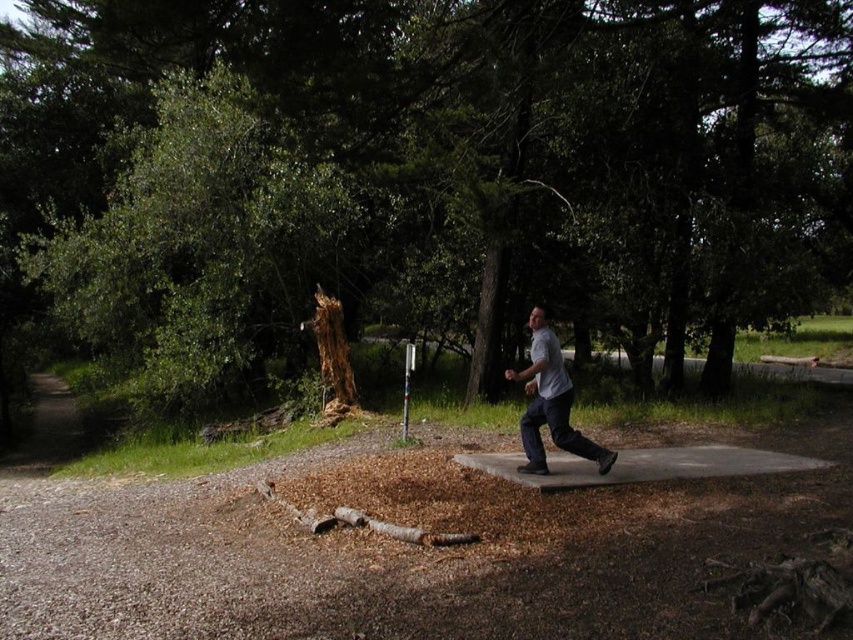
Question: From the image, what is the correct spatial relationship of brown rough tree at center in relation to concrete slab at center?

Choices:
 (A) below
 (B) above

Answer: (B)

Question: Where is concrete slab at center located in relation to white cotton shirt at center in the image?

Choices:
 (A) left
 (B) right

Answer: (B)

Question: Which point is farther to the camera?

Choices:
 (A) (780, 128)
 (B) (666, 464)
 (C) (527, 465)

Answer: (A)

Question: Which is nearer to the white cotton shirt at center?

Choices:
 (A) brown rough tree at center
 (B) concrete slab at center

Answer: (B)

Question: Which object is the farthest from the white cotton shirt at center?

Choices:
 (A) brown rough tree at center
 (B) concrete slab at center

Answer: (A)

Question: Is brown rough tree at center to the right of white cotton shirt at center from the viewer's perspective?

Choices:
 (A) no
 (B) yes

Answer: (A)